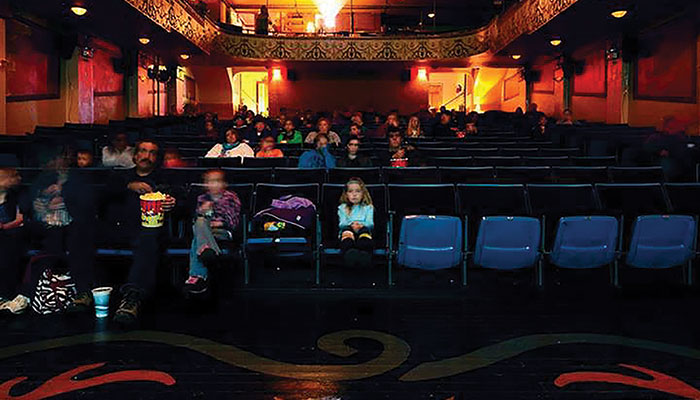
Find the location of a particular element. This screenshot has width=700, height=400. upturned seats is located at coordinates (434, 245), (519, 248), (579, 242), (671, 248).